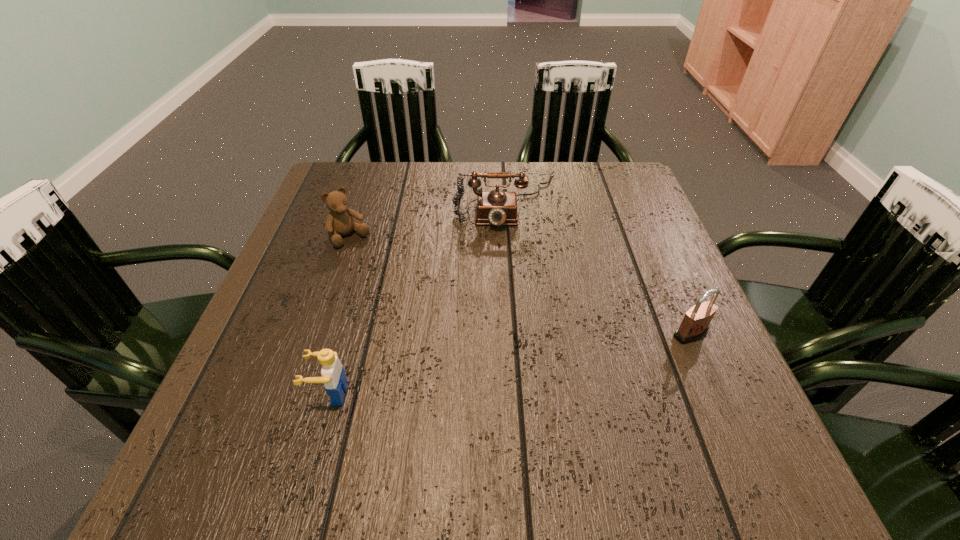
Identify the location of vacant region at the near edge of the desktop. (639, 405).

In the image, there is a desktop. Where is `free space at the right edge`? free space at the right edge is located at coordinates (600, 216).

You are a GUI agent. You are given a task and a screenshot of the screen. Output one action in this format:
    pyautogui.click(x=<x>, y=<y>)
    Task: Click on the free space at the near left corner of the desktop
    
    Given the screenshot: What is the action you would take?
    pyautogui.click(x=282, y=407)

Where is `free spot between the Lego and the teddy bear`? The image size is (960, 540). free spot between the Lego and the teddy bear is located at coordinates (340, 316).

Identify the location of free space between the teddy bear and the nearest object. (340, 316).

Where is `vacant area that lies between the Lego and the third object from left to right`? This screenshot has height=540, width=960. vacant area that lies between the Lego and the third object from left to right is located at coordinates (419, 297).

I want to click on free space between the third farthest object and the third object from left to right, so click(x=599, y=267).

The image size is (960, 540). What are the coordinates of `blank region between the rightmost object and the nearest object` in the screenshot? It's located at (510, 363).

Identify the location of free space between the rightmost object and the teddy bear. This screenshot has height=540, width=960. point(520,286).

This screenshot has width=960, height=540. What are the coordinates of `vacant space that's between the nearest object and the telephone` in the screenshot? It's located at (419, 297).